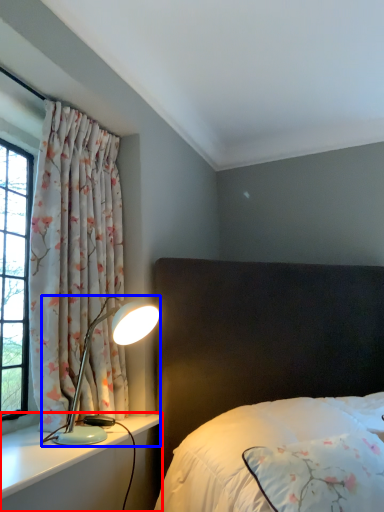
Question: Which object is closer to the camera taking this photo, dresser (highlighted by a red box) or lamp (highlighted by a blue box)?

Choices:
 (A) dresser
 (B) lamp

Answer: (A)